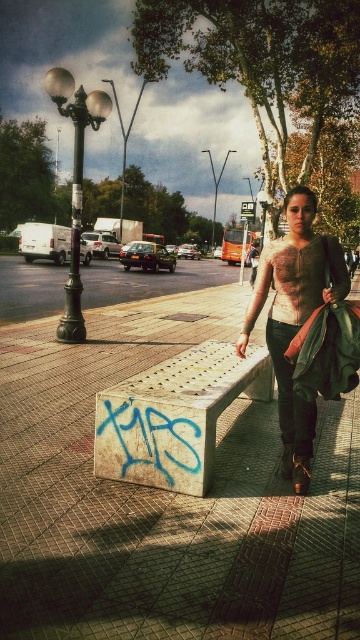
Question: Does concrete bench at center have a greater width compared to white textured bench at center?

Choices:
 (A) yes
 (B) no

Answer: (A)

Question: Among these points, which one is farthest from the camera?

Choices:
 (A) (173, 328)
 (B) (219, 352)
 (C) (326, 289)

Answer: (A)

Question: Estimate the real-world distances between objects in this image. Which object is closer to the white textured bench at center?

Choices:
 (A) textured beige sweater at center
 (B) concrete bench at center

Answer: (A)

Question: Can you confirm if concrete bench at center is smaller than white textured bench at center?

Choices:
 (A) no
 (B) yes

Answer: (A)

Question: Which object is farther from the camera taking this photo?

Choices:
 (A) textured beige sweater at center
 (B) white textured bench at center
 (C) concrete bench at center

Answer: (B)

Question: Does concrete bench at center have a larger size compared to white textured bench at center?

Choices:
 (A) yes
 (B) no

Answer: (A)